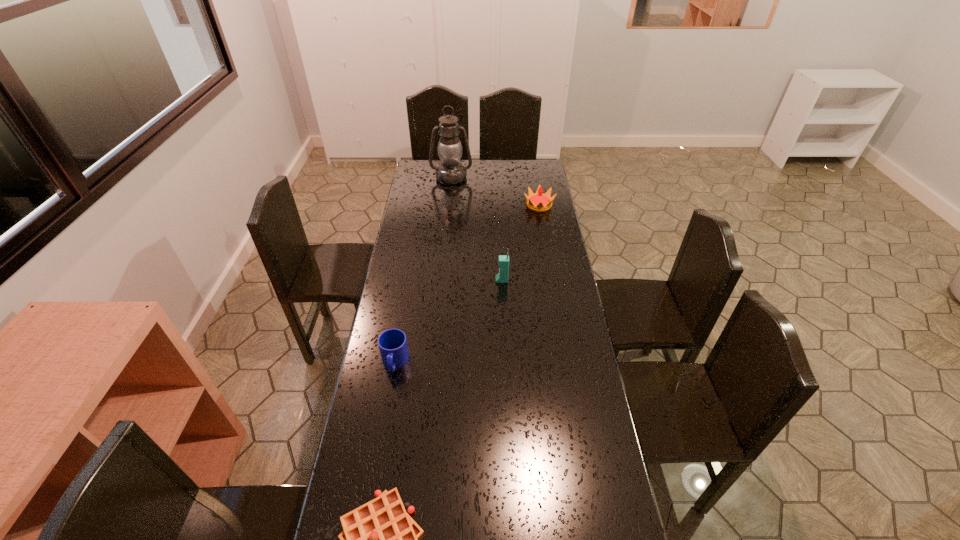
Find the location of `vacant space located 0.090m on the keypad of the fourth object from left to right`. vacant space located 0.090m on the keypad of the fourth object from left to right is located at coordinates (473, 280).

What are the coordinates of `vacant space positioned 0.130m on the keypad of the fourth object from left to right` in the screenshot? It's located at [x=464, y=280].

Where is `vacant point located on the left of the rightmost object`? vacant point located on the left of the rightmost object is located at coordinates (513, 206).

Where is `vacant space located 0.380m on the side with the handle of the second shortest object`? This screenshot has height=540, width=960. vacant space located 0.380m on the side with the handle of the second shortest object is located at coordinates (372, 499).

The height and width of the screenshot is (540, 960). In order to click on object located at the far edge in this screenshot , I will do `click(450, 171)`.

Find the location of a particular element. The height and width of the screenshot is (540, 960). oil lamp located at the left edge is located at coordinates (450, 171).

Where is `mug situated at the left edge`? This screenshot has width=960, height=540. mug situated at the left edge is located at coordinates (392, 343).

Where is `object that is at the right edge`? The image size is (960, 540). object that is at the right edge is located at coordinates (538, 202).

Locate an element on the screen. Image resolution: width=960 pixels, height=540 pixels. object that is at the far left corner is located at coordinates pyautogui.click(x=450, y=171).

Where is `vacant space at the far edge of the desktop`? vacant space at the far edge of the desktop is located at coordinates (512, 175).